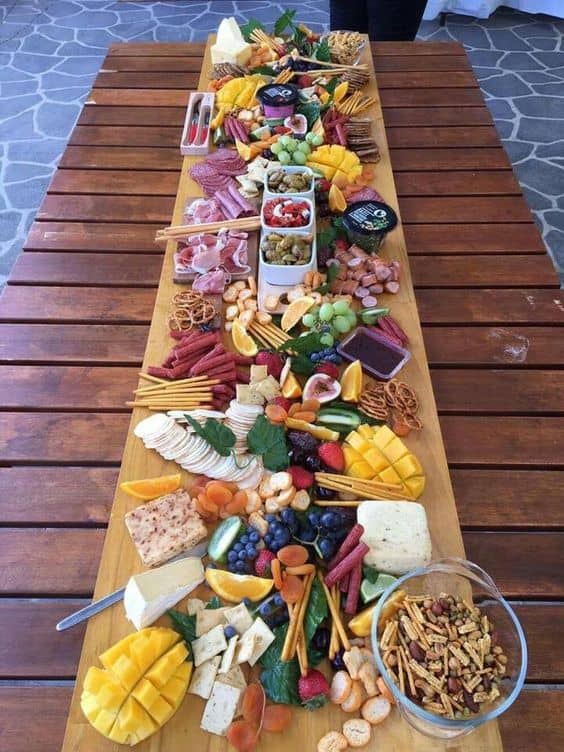
The width and height of the screenshot is (564, 752). In order to click on wood board in this screenshot , I will do (452, 549).